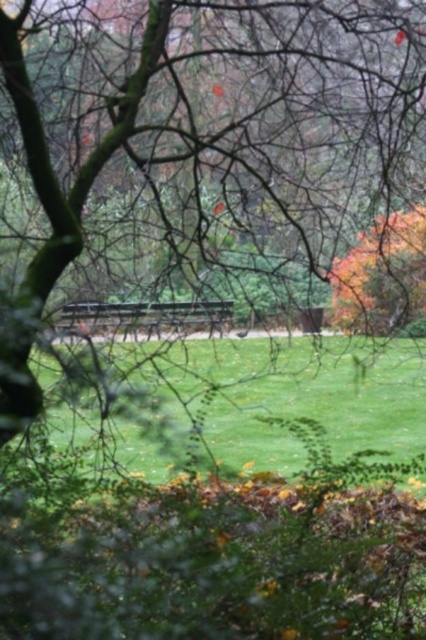
Looking at this image, you are standing at the point with coordinates point (108, 326) and want to walk towards the point with coordinates point (416, 376). According to the scene, will the path between these two points be obstructed by any objects?

Point (416, 376) is behind point (108, 326), so the path between them is not obstructed because the destination point is located behind the starting point, implying a clear line of sight.

You are a gardener who needs to mow the green grassy at center. However, there is a wooden park bench at center in the way. Can you mow the grassy area without moving the bench?

The green grassy at center is much taller than the wooden park bench at center. Since the grass is taller, you can mow it while the bench remains in place as the mower can cut the grass around and under the bench.

You are a photographer standing in the park and want to take a photo of the green grassy at center and the wooden park bench at center. Which object is closer to you, the photographer?

The green grassy at center is closer to the photographer because it is further to the viewer than the wooden park bench at center.